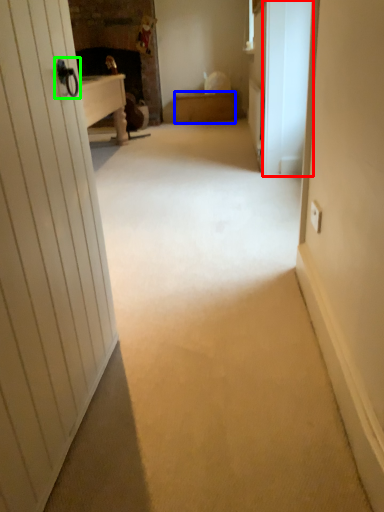
Question: Considering the real-world distances, which object is closest to screen door (highlighted by a red box)? furniture (highlighted by a blue box) or door handle (highlighted by a green box).

Choices:
 (A) furniture
 (B) door handle

Answer: (B)